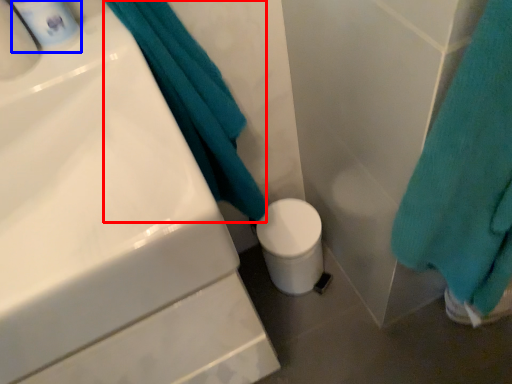
Question: Among these objects, which one is nearest to the camera, bath towel (highlighted by a red box) or mouthwash (highlighted by a blue box)?

Choices:
 (A) bath towel
 (B) mouthwash

Answer: (B)